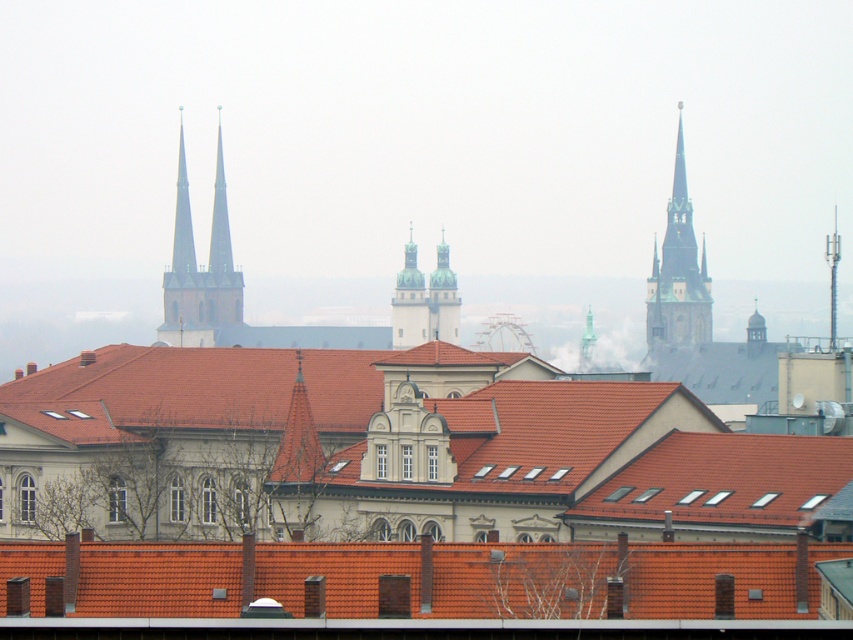
Question: Which object is farther from the camera taking this photo?

Choices:
 (A) smooth stone towers at upper left
 (B) orange tiled roof at lower center
 (C) green stone spire at upper center

Answer: (C)

Question: Among these points, which one is nearest to the camera?

Choices:
 (A) (432, 333)
 (B) (444, 324)
 (C) (347, 589)

Answer: (C)

Question: Which object appears closest to the camera in this image?

Choices:
 (A) smooth stone spire at upper left
 (B) green stone spire at upper center
 (C) gold textured spire at center
 (D) smooth stone spire at upper right

Answer: (C)

Question: Is metallic spire at upper right positioned before green stone spire at upper center?

Choices:
 (A) yes
 (B) no

Answer: (A)

Question: Is orange tiled roof at lower center smaller than gold textured spire at center?

Choices:
 (A) no
 (B) yes

Answer: (B)

Question: Where is smooth gray tower at center located in relation to green stone spire at upper center in the image?

Choices:
 (A) left
 (B) right

Answer: (A)